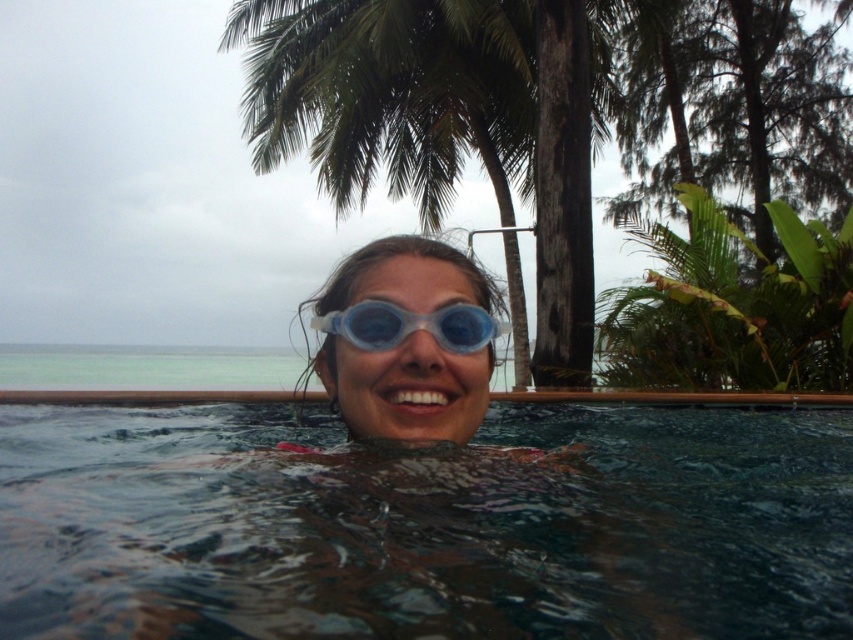
Question: Does green leafy palm tree at upper center appear under transparent plastic goggles at center?

Choices:
 (A) yes
 (B) no

Answer: (B)

Question: Does transparent plastic water at center appear on the left side of transparent plastic goggles at center?

Choices:
 (A) no
 (B) yes

Answer: (A)

Question: Is transparent plastic water at center behind transparent blue goggles at center?

Choices:
 (A) yes
 (B) no

Answer: (B)

Question: Estimate the real-world distances between objects in this image. Which object is farther from the transparent plastic goggles at center?

Choices:
 (A) green leafy palm tree at upper center
 (B) transparent blue goggles at center

Answer: (A)

Question: Which of the following is the farthest from the observer?

Choices:
 (A) transparent blue goggles at center
 (B) transparent plastic water at center
 (C) transparent plastic goggles at center

Answer: (C)

Question: Which object is positioned closest to the green leafy palm tree at upper center?

Choices:
 (A) transparent plastic goggles at center
 (B) transparent blue goggles at center
 (C) transparent plastic water at center

Answer: (B)